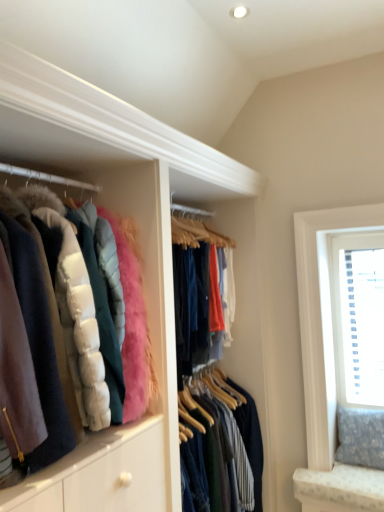
Question: From a real-world perspective, is white textured blinds at upper right located beneath velvet-like pink puffer jacket at left?

Choices:
 (A) yes
 (B) no

Answer: (A)

Question: From the image's perspective, is white textured blinds at upper right under velvet-like pink puffer jacket at left?

Choices:
 (A) no
 (B) yes

Answer: (B)

Question: From a real-world perspective, is white textured blinds at upper right physically above velvet-like pink puffer jacket at left?

Choices:
 (A) no
 (B) yes

Answer: (A)

Question: Is white textured blinds at upper right smaller than velvet-like pink puffer jacket at left?

Choices:
 (A) yes
 (B) no

Answer: (A)

Question: Can you confirm if white textured blinds at upper right is shorter than velvet-like pink puffer jacket at left?

Choices:
 (A) yes
 (B) no

Answer: (B)

Question: Are white textured blinds at upper right and velvet-like pink puffer jacket at left beside each other?

Choices:
 (A) yes
 (B) no

Answer: (B)

Question: Is velvet-like pink puffer jacket at left bigger than white textured blinds at upper right?

Choices:
 (A) no
 (B) yes

Answer: (B)

Question: Can you confirm if velvet-like pink puffer jacket at left is thinner than white textured blinds at upper right?

Choices:
 (A) no
 (B) yes

Answer: (A)

Question: Is velvet-like pink puffer jacket at left closer to camera compared to white textured blinds at upper right?

Choices:
 (A) no
 (B) yes

Answer: (B)

Question: Is velvet-like pink puffer jacket at left positioned far away from white textured blinds at upper right?

Choices:
 (A) no
 (B) yes

Answer: (B)

Question: Would you say white textured blinds at upper right is part of velvet-like pink puffer jacket at left's contents?

Choices:
 (A) no
 (B) yes

Answer: (A)

Question: Is velvet-like pink puffer jacket at left outside of white textured blinds at upper right?

Choices:
 (A) no
 (B) yes

Answer: (B)

Question: Does point (43, 206) appear closer or farther from the camera than point (377, 263)?

Choices:
 (A) closer
 (B) farther

Answer: (A)